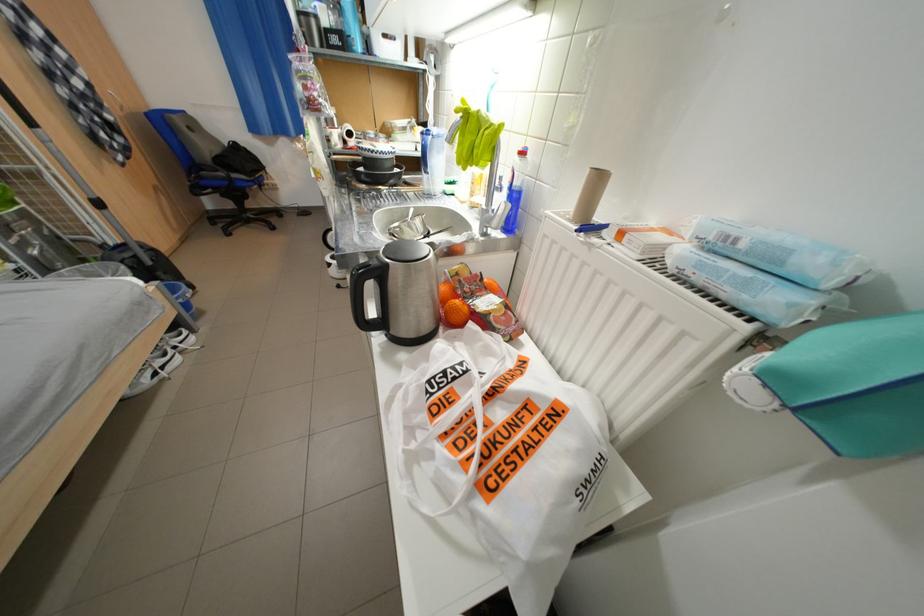
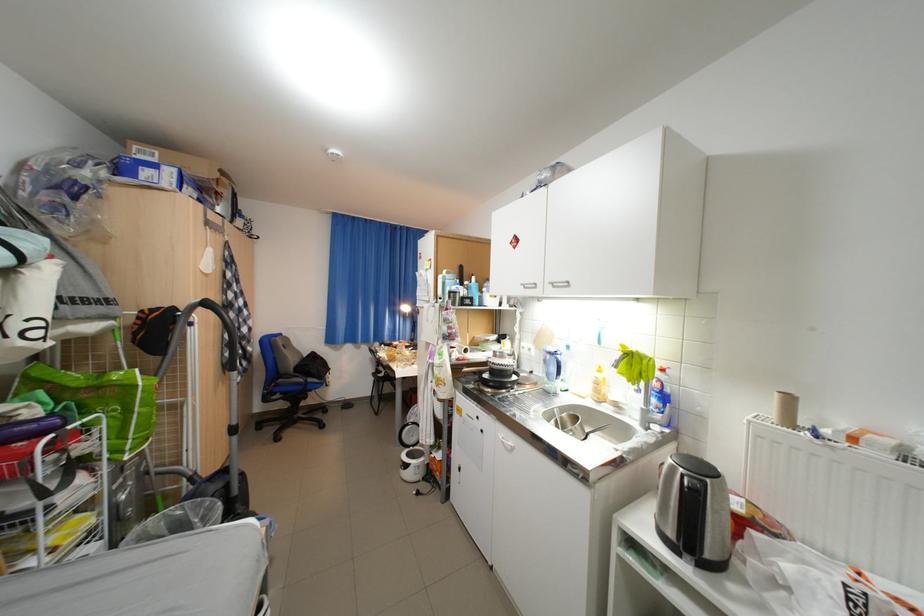
Where in the second image is the point corresponding to point 473,204 from the first image?

(594, 399)